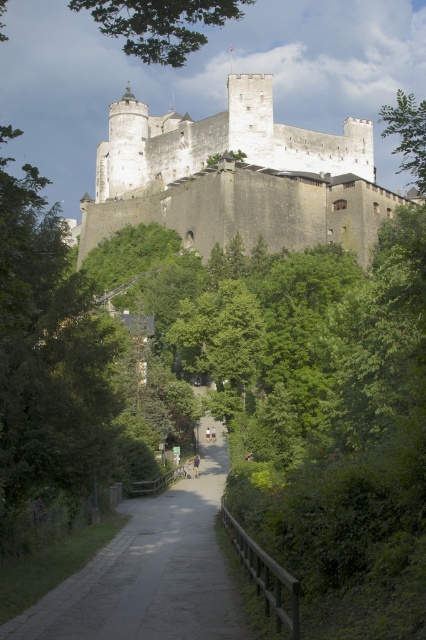
How far apart are white stone castle at upper center and green leafy tree at upper right?

white stone castle at upper center is 33.86 meters from green leafy tree at upper right.

Can you confirm if white stone castle at upper center is taller than green leafy tree at upper right?

No, white stone castle at upper center is not taller than green leafy tree at upper right.

Is point (132, 156) farther from viewer compared to point (405, 132)?

That is True.

Where is `white stone castle at upper center`? This screenshot has width=426, height=640. white stone castle at upper center is located at coordinates (236, 177).

Is white stone castle at upper center taller than gray concrete path at center?

Yes, white stone castle at upper center is taller than gray concrete path at center.

Is white stone castle at upper center below gray concrete path at center?

Actually, white stone castle at upper center is above gray concrete path at center.

Between point (342, 211) and point (123, 605), which one is positioned in front?

Point (123, 605) is in front.

I want to click on white stone castle at upper center, so click(x=236, y=177).

Which is above, gray concrete path at center or green leafy tree at upper right?

green leafy tree at upper right is higher up.

Consider the image. Which of these two, gray concrete path at center or green leafy tree at upper right, stands shorter?

gray concrete path at center

What do you see at coordinates (150, 572) in the screenshot? The width and height of the screenshot is (426, 640). I see `gray concrete path at center` at bounding box center [150, 572].

I want to click on gray concrete path at center, so click(x=150, y=572).